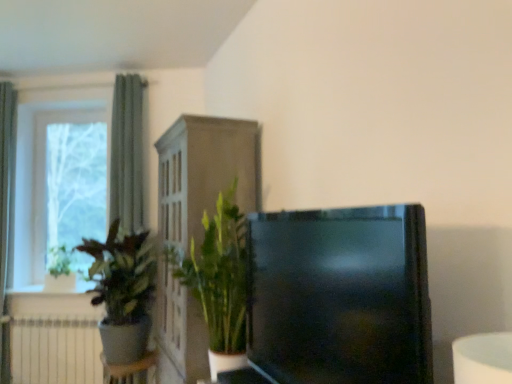
Question: From a real-world perspective, is black glossy tv at center positioned over green fabric curtain at left, the 2th curtain viewed from the right, based on gravity?

Choices:
 (A) yes
 (B) no

Answer: (B)

Question: Considering the relative sizes of black glossy tv at center and green fabric curtain at left, the 2th curtain viewed from the right, in the image provided, is black glossy tv at center wider than green fabric curtain at left, the 2th curtain viewed from the right,?

Choices:
 (A) no
 (B) yes

Answer: (B)

Question: Does black glossy tv at center have a greater height compared to green fabric curtain at left, the first curtain in the left-to-right sequence?

Choices:
 (A) yes
 (B) no

Answer: (B)

Question: Could you tell me if black glossy tv at center is turned towards green fabric curtain at left, the 2th curtain viewed from the right?

Choices:
 (A) no
 (B) yes

Answer: (A)

Question: Does black glossy tv at center contain green fabric curtain at left, the 2th curtain viewed from the right?

Choices:
 (A) yes
 (B) no

Answer: (B)

Question: Is black glossy tv at center in front of green fabric curtain at left, the 2th curtain viewed from the right?

Choices:
 (A) yes
 (B) no

Answer: (A)

Question: Is green leafy plant at center, arranged as the first houseplant when viewed from the right, oriented away from white matte radiator at lower left?

Choices:
 (A) yes
 (B) no

Answer: (B)

Question: Is green leafy plant at center, positioned as the second houseplant in left-to-right order, wider than white matte radiator at lower left?

Choices:
 (A) no
 (B) yes

Answer: (B)

Question: Can you confirm if green leafy plant at center, positioned as the second houseplant in left-to-right order, is bigger than white matte radiator at lower left?

Choices:
 (A) yes
 (B) no

Answer: (A)

Question: Does green leafy plant at center, positioned as the second houseplant in left-to-right order, come in front of white matte radiator at lower left?

Choices:
 (A) yes
 (B) no

Answer: (A)

Question: From a real-world perspective, is green leafy plant at center, positioned as the second houseplant in left-to-right order, located higher than white matte radiator at lower left?

Choices:
 (A) no
 (B) yes

Answer: (B)

Question: Is green fabric curtain at left, the 1th curtain when ordered from right to left, bigger than white matte radiator at lower left?

Choices:
 (A) no
 (B) yes

Answer: (B)